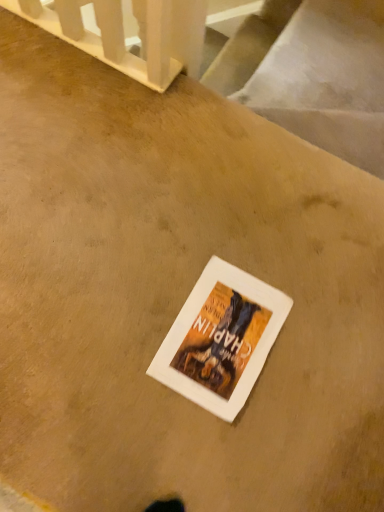
Image resolution: width=384 pixels, height=512 pixels. I want to click on free point to the right of white paper book at center, so click(x=319, y=358).